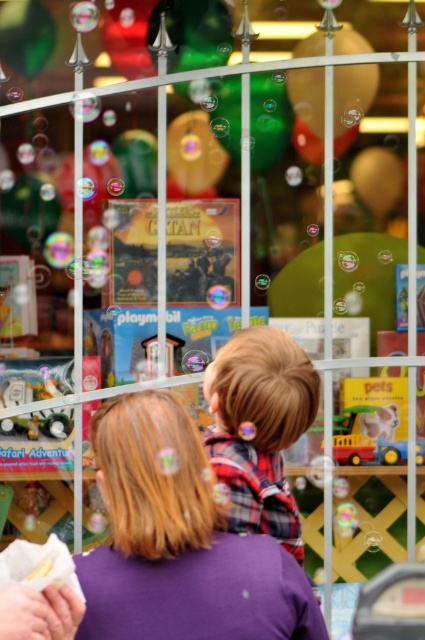
You are a delivery person who needs to place a small package between the plaid fabric hair clip at center and the metallic silver watch at left. The package is 5 feet long. Will it fit between them?

The distance between the plaid fabric hair clip at center and the metallic silver watch at left is 6.16 feet. Since the package is 5 feet long, it will fit between them as there is enough space.

You are a customer looking at the toy store window display. You see a plaid fabric hair clip at center. Is the plaid fabric hair clip at center located to the left or right of the point at coordinates (x=260, y=428)?

The plaid fabric hair clip at center is located exactly at the point (x=260, y=428), so it is neither to the left nor right of that point.

You are a delivery person who needs to place a new toy box that is 4 meters long between the plaid fabric hair clip at center and the green matte balloon at upper center. Can you fit the toy box between them without overlapping either object?

The plaid fabric hair clip at center is 3.87 meters from the green matte balloon at upper center. Since the toy box is 4 meters long, it cannot fit between them without overlapping one of the objects because the distance is shorter than the toy box length.